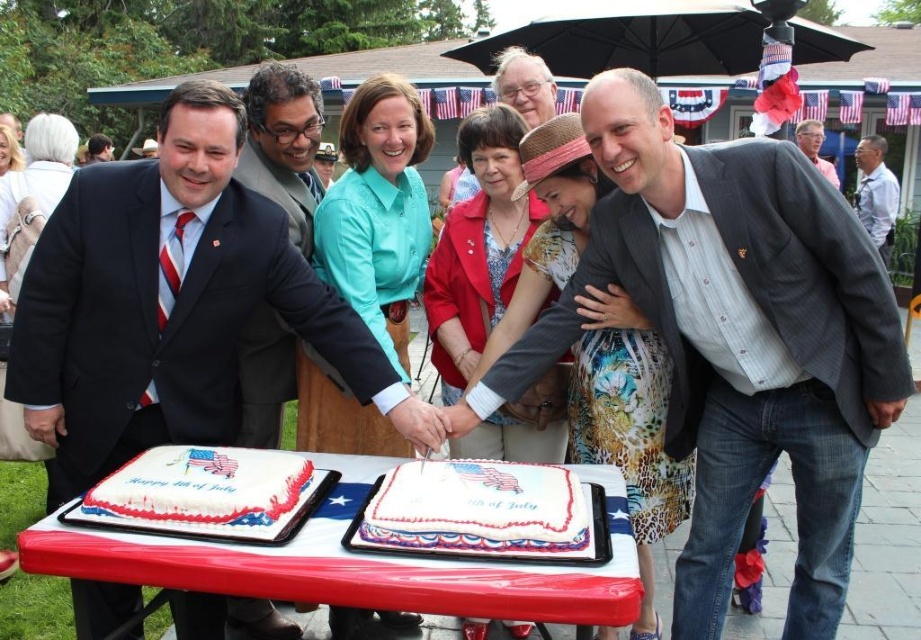
Question: Which of these objects is positioned closest to the light brown wood chair at upper right?

Choices:
 (A) white frosted cake at lower left
 (B) shiny black suit at center

Answer: (B)

Question: Which is nearer to the white frosted cake at center?

Choices:
 (A) light brown wood chair at upper right
 (B) matte black suit at left
 (C) shiny black suit at center
 (D) white frosted cake at lower left

Answer: (D)

Question: Does gray textured blazer at center appear on the left side of white frosted cake at lower left?

Choices:
 (A) no
 (B) yes

Answer: (A)

Question: Can you confirm if gray textured blazer at center is positioned to the left of matte black suit at left?

Choices:
 (A) no
 (B) yes

Answer: (A)

Question: Which of these objects is positioned farthest from the white glossy table at center?

Choices:
 (A) light brown wood chair at upper right
 (B) shiny black suit at center
 (C) matte black suit at left
 (D) gray shirt at upper right

Answer: (D)

Question: Is white frosted cake at center above shiny black suit at center?

Choices:
 (A) no
 (B) yes

Answer: (A)